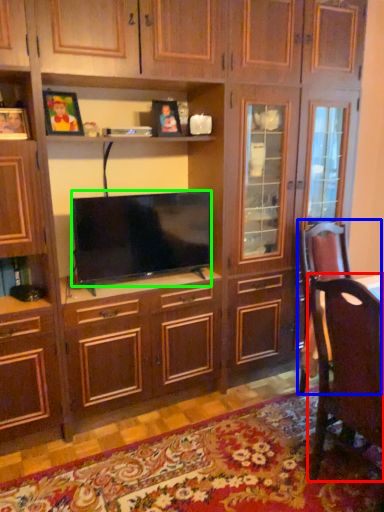
Question: Considering the real-world distances, which object is closest to chair (highlighted by a red box)? swivel chair (highlighted by a blue box) or television (highlighted by a green box).

Choices:
 (A) swivel chair
 (B) television

Answer: (A)